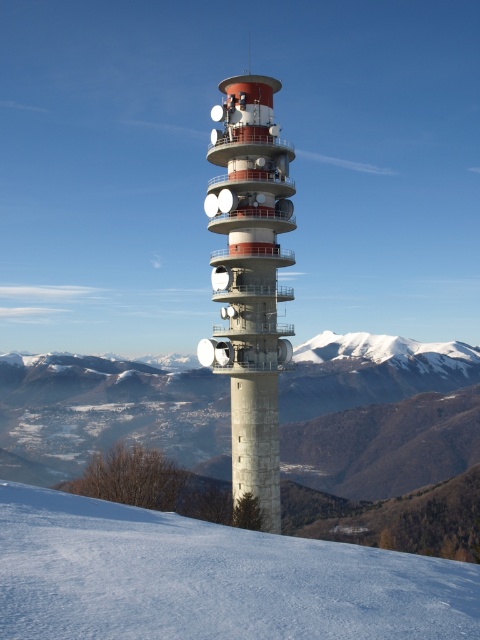
Who is more forward, (343, 577) or (266, 508)?

Point (343, 577)

Describe the element at coordinates (210, 579) in the screenshot. I see `white snow at lower center` at that location.

Is point (272, 589) farther from camera compared to point (274, 406)?

No, (272, 589) is in front of (274, 406).

At what (x,y) coordinates should I click in order to perform the action: click on white snow at lower center. Please return your answer as a coordinate pair (x, y). This screenshot has height=640, width=480. Looking at the image, I should click on (210, 579).